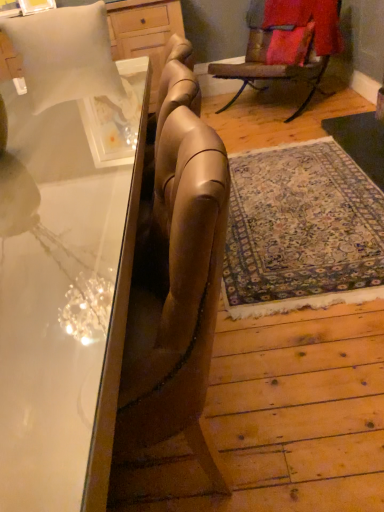
Question: Is the position of wooden rocking chair at upper right less distant than that of white matte pillow at upper left, acting as the 1th pillow starting from the front?

Choices:
 (A) no
 (B) yes

Answer: (A)

Question: Considering the relative positions of wooden rocking chair at upper right and white matte pillow at upper left, acting as the 1th pillow starting from the front, in the image provided, is wooden rocking chair at upper right behind white matte pillow at upper left, acting as the 1th pillow starting from the front,?

Choices:
 (A) yes
 (B) no

Answer: (A)

Question: Is wooden rocking chair at upper right bigger than white matte pillow at upper left, acting as the 1th pillow starting from the front?

Choices:
 (A) no
 (B) yes

Answer: (B)

Question: Is wooden rocking chair at upper right not close to white matte pillow at upper left, which is the first pillow in bottom-to-top order?

Choices:
 (A) no
 (B) yes

Answer: (B)

Question: Is wooden rocking chair at upper right to the right of white matte pillow at upper left, the 2th pillow viewed from the top, from the viewer's perspective?

Choices:
 (A) yes
 (B) no

Answer: (A)

Question: Is wooden rocking chair at upper right thinner than white matte pillow at upper left, placed as the 2th pillow when sorted from back to front?

Choices:
 (A) no
 (B) yes

Answer: (B)

Question: Is velvet red pillow at upper right, positioned as the second pillow in bottom-to-top order, behind wooden rocking chair at upper right?

Choices:
 (A) yes
 (B) no

Answer: (A)

Question: Is velvet red pillow at upper right, the second pillow when ordered from front to back, wider than wooden rocking chair at upper right?

Choices:
 (A) no
 (B) yes

Answer: (A)

Question: Is velvet red pillow at upper right, positioned as the second pillow in bottom-to-top order, thinner than wooden rocking chair at upper right?

Choices:
 (A) yes
 (B) no

Answer: (A)

Question: Is velvet red pillow at upper right, positioned as the second pillow in bottom-to-top order, positioned beyond the bounds of wooden rocking chair at upper right?

Choices:
 (A) yes
 (B) no

Answer: (B)

Question: Is velvet red pillow at upper right, positioned as the second pillow in bottom-to-top order, positioned far away from wooden rocking chair at upper right?

Choices:
 (A) no
 (B) yes

Answer: (A)

Question: Considering the relative sizes of velvet red pillow at upper right, which is the 2th pillow in left-to-right order, and wooden rocking chair at upper right in the image provided, is velvet red pillow at upper right, which is the 2th pillow in left-to-right order, shorter than wooden rocking chair at upper right?

Choices:
 (A) yes
 (B) no

Answer: (A)

Question: Does velvet red pillow at upper right, the second pillow when ordered from front to back, have a greater width compared to clear glass desk at left?

Choices:
 (A) no
 (B) yes

Answer: (A)